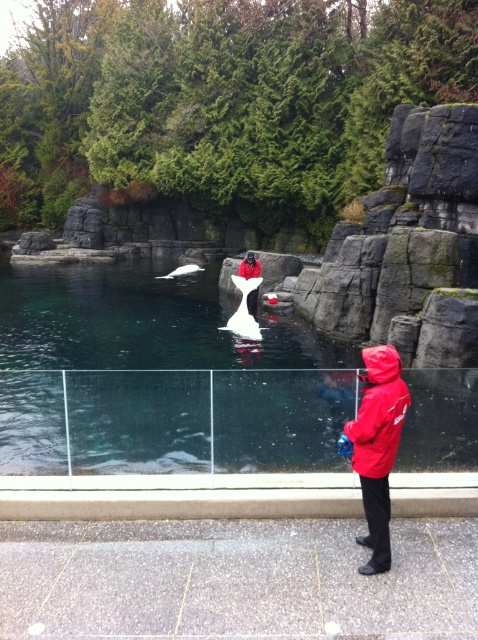
Does red matte jacket at lower right have a lesser width compared to red matte jacket at center?

Correct, red matte jacket at lower right's width is less than red matte jacket at center's.

Does red matte jacket at lower right lie in front of red matte jacket at center?

Yes, it is in front of red matte jacket at center.

Locate an element on the screen. red matte jacket at lower right is located at coordinates (378, 413).

Is the position of clear glass water at center more distant than that of red matte jacket at center?

No, clear glass water at center is closer to the viewer.

Who is positioned more to the left, clear glass water at center or red matte jacket at center?

clear glass water at center

Find the location of `clear glass water at center`. clear glass water at center is located at coordinates (158, 378).

Can you confirm if red matte jacket at lower right is shorter than white glossy swan at center?

Correct, red matte jacket at lower right is not as tall as white glossy swan at center.

Based on the photo, which is more to the right, red matte jacket at lower right or white glossy swan at center?

red matte jacket at lower right is more to the right.

The width and height of the screenshot is (478, 640). Identify the location of red matte jacket at lower right. (378, 413).

At what (x,y) coordinates should I click in order to perform the action: click on red matte jacket at lower right. Please return your answer as a coordinate pair (x, y). Looking at the image, I should click on (378, 413).